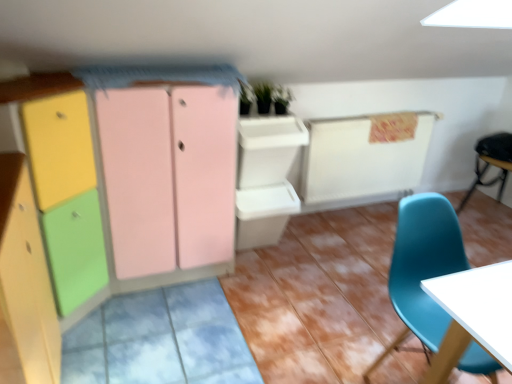
Question: Should I look upward or downward to see black leather chair at right, the first chair in the right-to-left sequence?

Choices:
 (A) down
 (B) up

Answer: (B)

Question: Is matte wood cabinet at left, placed as the second cabinetry when sorted from front to back, next to matte wood cabinet at left, marked as the third cabinetry in a back-to-front arrangement?

Choices:
 (A) yes
 (B) no

Answer: (B)

Question: Is matte wood cabinet at left, placed as the second cabinetry when sorted from front to back, aimed at matte wood cabinet at left, marked as the third cabinetry in a back-to-front arrangement?

Choices:
 (A) no
 (B) yes

Answer: (A)

Question: Is matte wood cabinet at left, placed as the second cabinetry when sorted from front to back, further to camera compared to matte wood cabinet at left, the first cabinetry in the front-to-back sequence?

Choices:
 (A) yes
 (B) no

Answer: (A)

Question: Does matte wood cabinet at left, placed as the second cabinetry when sorted from front to back, have a greater width compared to matte wood cabinet at left, marked as the third cabinetry in a back-to-front arrangement?

Choices:
 (A) no
 (B) yes

Answer: (B)

Question: Is matte wood cabinet at left, the second cabinetry when ordered from back to front, positioned with its back to matte wood cabinet at left, marked as the third cabinetry in a back-to-front arrangement?

Choices:
 (A) no
 (B) yes

Answer: (A)

Question: Could matte wood cabinet at left, marked as the third cabinetry in a back-to-front arrangement, be considered to be inside matte wood cabinet at left, the second cabinetry when ordered from back to front?

Choices:
 (A) no
 (B) yes

Answer: (A)

Question: Is black leather chair at right, the first chair in the right-to-left sequence, positioned behind matte plastic dresser at center?

Choices:
 (A) no
 (B) yes

Answer: (B)

Question: Can you confirm if black leather chair at right, which is the second chair in left-to-right order, is positioned to the left of matte plastic dresser at center?

Choices:
 (A) no
 (B) yes

Answer: (A)

Question: Can you confirm if black leather chair at right, the first chair in the right-to-left sequence, is taller than matte plastic dresser at center?

Choices:
 (A) yes
 (B) no

Answer: (B)

Question: From the image's perspective, would you say black leather chair at right, which is the second chair in left-to-right order, is shown under matte plastic dresser at center?

Choices:
 (A) yes
 (B) no

Answer: (B)

Question: Does black leather chair at right, which is the second chair in left-to-right order, turn towards matte plastic dresser at center?

Choices:
 (A) yes
 (B) no

Answer: (A)

Question: Does black leather chair at right, which is the first chair from top to bottom, have a smaller size compared to matte plastic dresser at center?

Choices:
 (A) yes
 (B) no

Answer: (A)

Question: Considering the relative sizes of matte pink cabinet at center, which is the 1th cabinetry from back to front, and black leather chair at right, which is the second chair in left-to-right order, in the image provided, is matte pink cabinet at center, which is the 1th cabinetry from back to front, wider than black leather chair at right, which is the second chair in left-to-right order,?

Choices:
 (A) no
 (B) yes

Answer: (B)